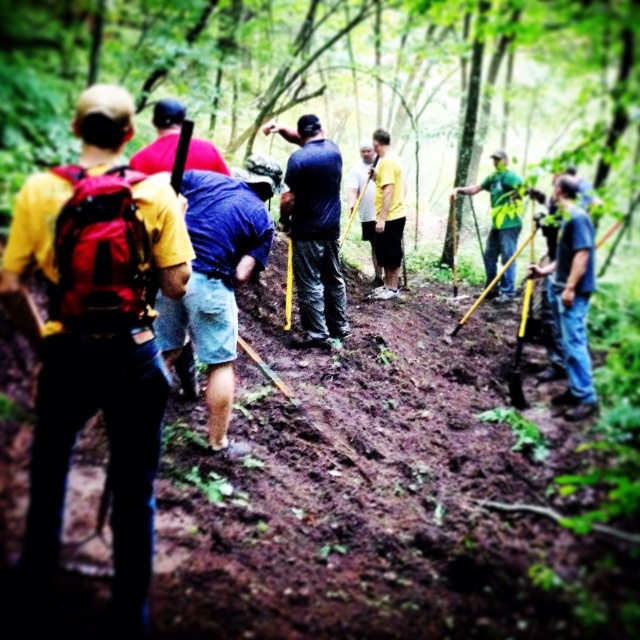
Measure the distance between point [243,195] and camera.

A: The distance of point [243,195] from camera is 13.42 feet.

Does point (225, 202) lie behind point (369, 294)?

No, (225, 202) is closer to viewer.

Identify the location of blue denim shorts at center. The width and height of the screenshot is (640, 640). (218, 276).

Is dark blue shirt at center above yellow matte shirt at center?

Incorrect, dark blue shirt at center is not positioned above yellow matte shirt at center.

Image resolution: width=640 pixels, height=640 pixels. What do you see at coordinates (314, 228) in the screenshot? I see `dark blue shirt at center` at bounding box center [314, 228].

Which is in front, point (298, 196) or point (196, 150)?

Point (196, 150)

The width and height of the screenshot is (640, 640). Find the location of `dark blue shirt at center`. dark blue shirt at center is located at coordinates (314, 228).

Who is positioned more to the right, blue denim shorts at center or blue jeans at center?

From the viewer's perspective, blue jeans at center appears more on the right side.

Where is `blue denim shorts at center`? This screenshot has width=640, height=640. blue denim shorts at center is located at coordinates (218, 276).

Is point (259, 257) positioned after point (568, 304)?

No.

Locate an element on the screen. This screenshot has height=640, width=640. blue denim shorts at center is located at coordinates (218, 276).